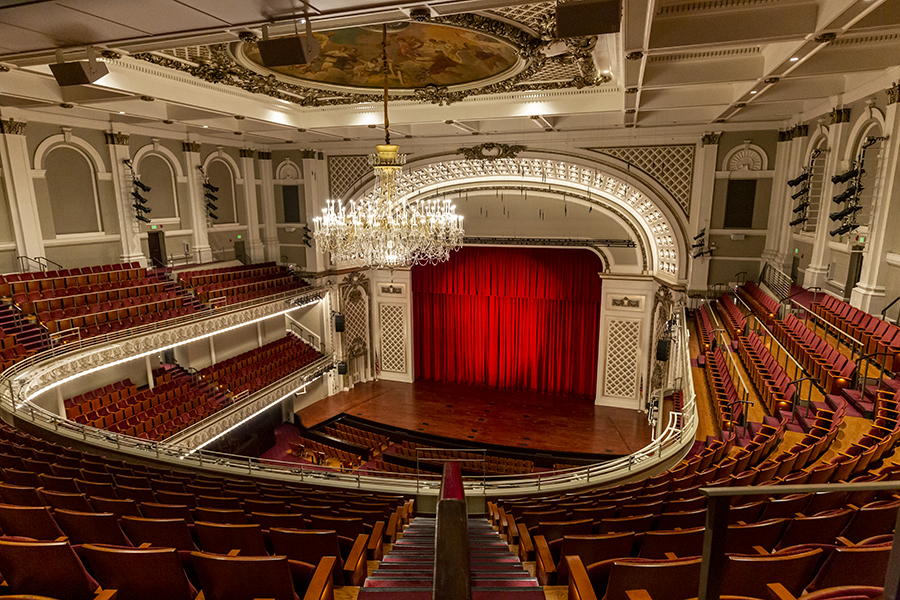
The height and width of the screenshot is (600, 900). Identify the location of red curtains. (510, 321).